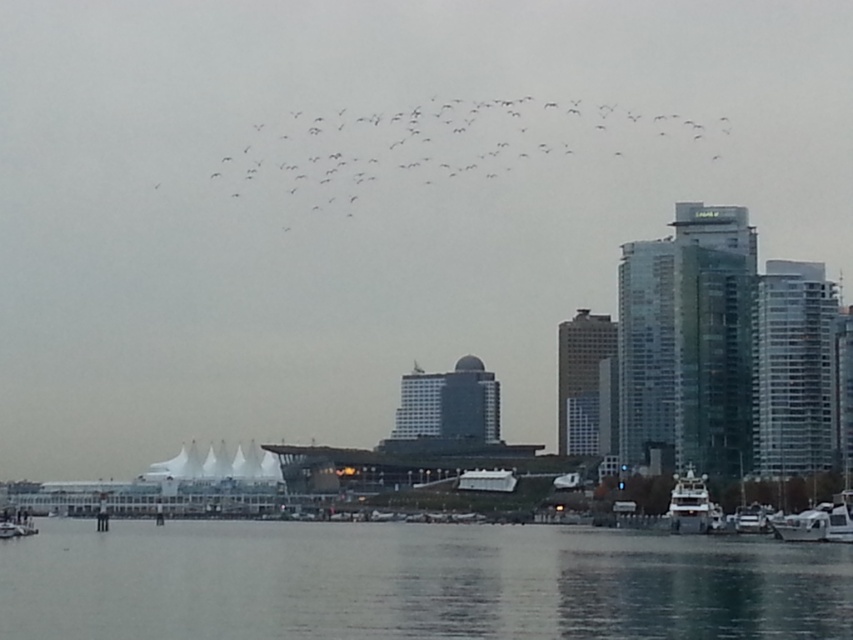
Question: Is transparent water at lower center below white glossy yacht at lower right?

Choices:
 (A) no
 (B) yes

Answer: (B)

Question: Is transparent water at lower center to the left of white glossy yacht at lower right from the viewer's perspective?

Choices:
 (A) no
 (B) yes

Answer: (B)

Question: Which object appears farthest from the camera in this image?

Choices:
 (A) white glossy yacht at lower right
 (B) transparent water at lower center

Answer: (A)

Question: Can you confirm if transparent water at lower center is thinner than white glossy yacht at lower right?

Choices:
 (A) yes
 (B) no

Answer: (B)